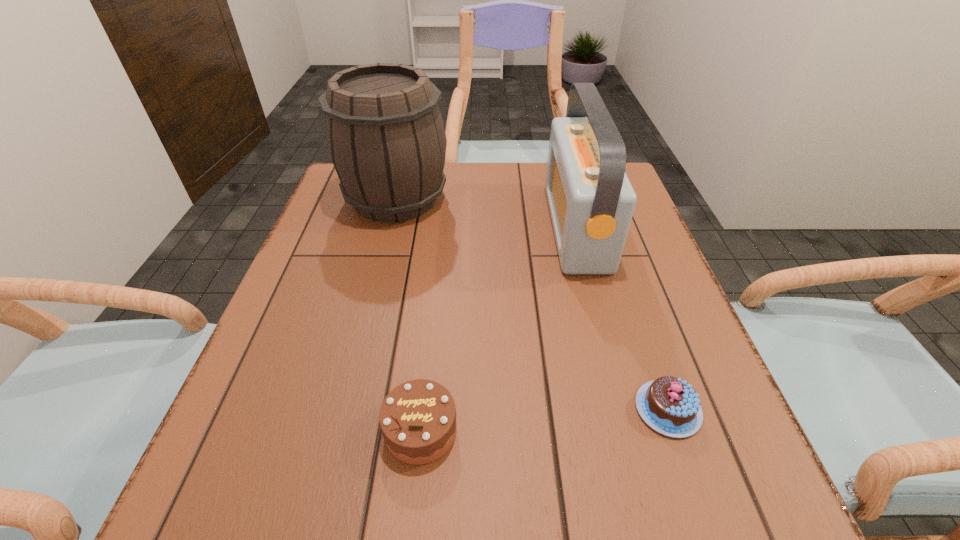
Identify the location of vacant area that lies between the shortest object and the left chocolate cake. This screenshot has width=960, height=540. (544, 420).

Where is `unoccupied area between the wine bucket and the shorter chocolate cake`? This screenshot has width=960, height=540. unoccupied area between the wine bucket and the shorter chocolate cake is located at coordinates (532, 304).

Find the location of a particular element. This screenshot has width=960, height=540. free space between the wine bucket and the left chocolate cake is located at coordinates 408,315.

This screenshot has height=540, width=960. I want to click on vacant area that lies between the radio receiver and the right chocolate cake, so click(x=622, y=318).

Point out which object is positioned as the second nearest to the wine bucket. Please provide its 2D coordinates. Your answer should be formatted as a tuple, i.e. [(x, y)], where the tuple contains the x and y coordinates of a point satisfying the conditions above.

[(417, 418)]

Find the location of a particular element. The width and height of the screenshot is (960, 540). the third closest object to the taller chocolate cake is located at coordinates (385, 135).

At what (x,y) coordinates should I click in order to perform the action: click on vacant area that satisfies the following two spatial constraints: 1. on the back side of the taller chocolate cake; 2. on the right side of the right chocolate cake. Please return your answer as a coordinate pair (x, y). The image size is (960, 540). Looking at the image, I should click on (423, 409).

At what (x,y) coordinates should I click in order to perform the action: click on vacant space that satisfies the following two spatial constraints: 1. on the front-facing side of the shorter chocolate cake; 2. on the left side of the radio receiver. Please return your answer as a coordinate pair (x, y). The height and width of the screenshot is (540, 960). Looking at the image, I should click on (625, 409).

At what (x,y) coordinates should I click in order to perform the action: click on vacant space that satisfies the following two spatial constraints: 1. on the front-facing side of the radio receiver; 2. on the front side of the third tallest object. Please return your answer as a coordinate pair (x, y). The height and width of the screenshot is (540, 960). Looking at the image, I should click on (631, 430).